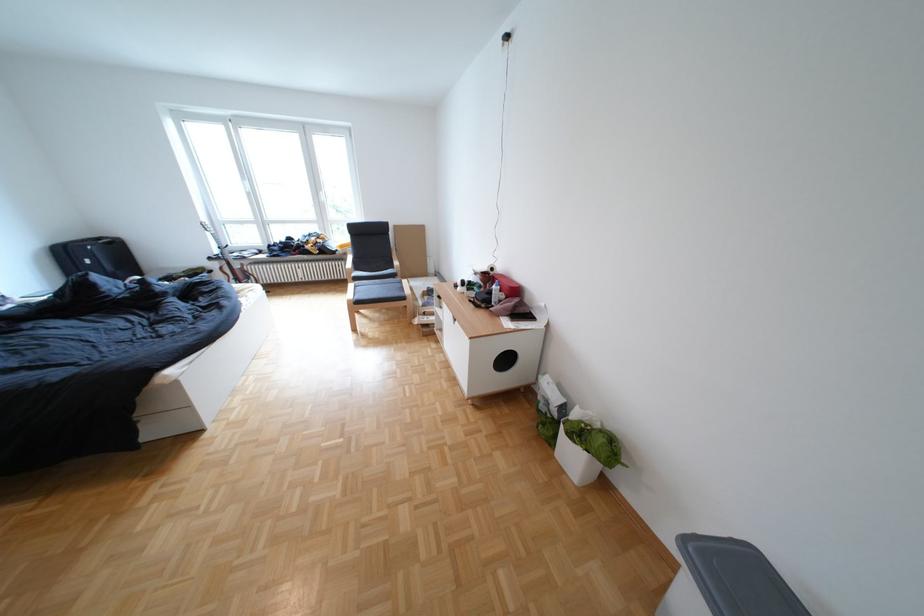
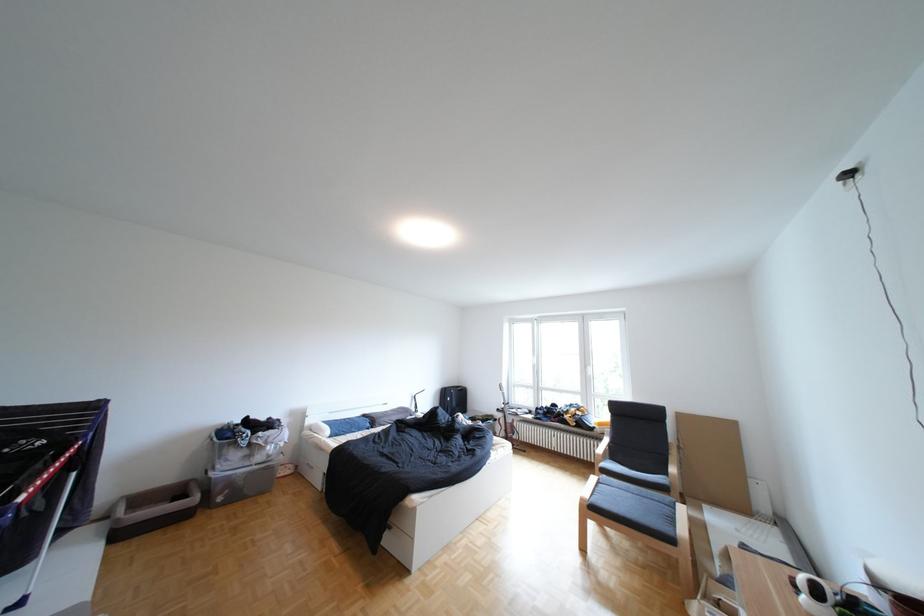
The point at (367, 286) is marked in the first image. Where is the corresponding point in the second image?

(610, 479)